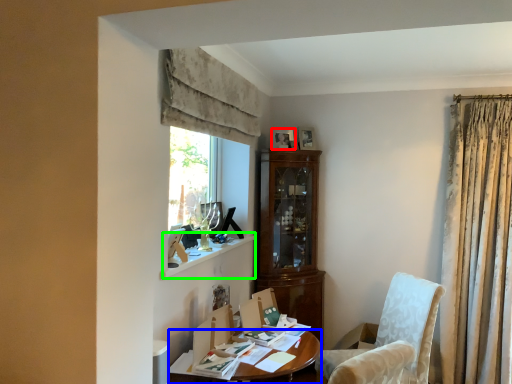
Question: Considering the real-world distances, which object is closest to picture frame (highlighted by a red box)? desk (highlighted by a blue box) or window sill (highlighted by a green box).

Choices:
 (A) desk
 (B) window sill

Answer: (B)